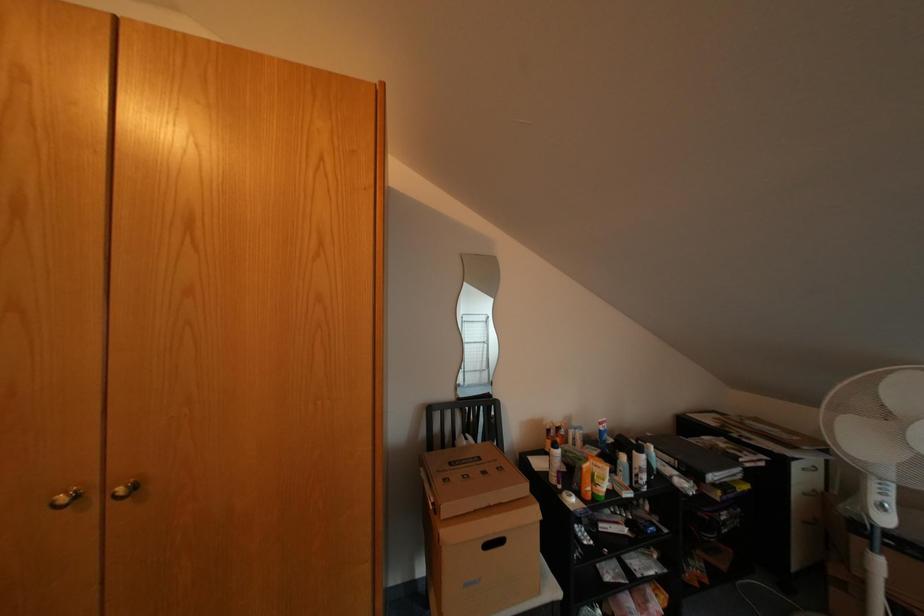
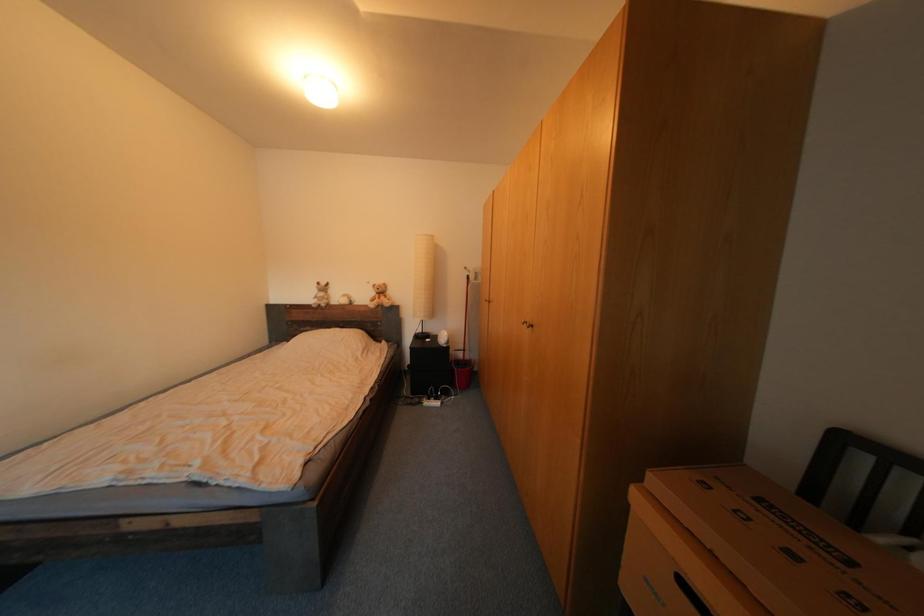
Question: The camera is either moving clockwise (left) or counter-clockwise (right) around the object. The first image is from the beginning of the video and the second image is from the end. Is the camera moving left or right when shooting the video?

Choices:
 (A) Left
 (B) Right

Answer: (B)